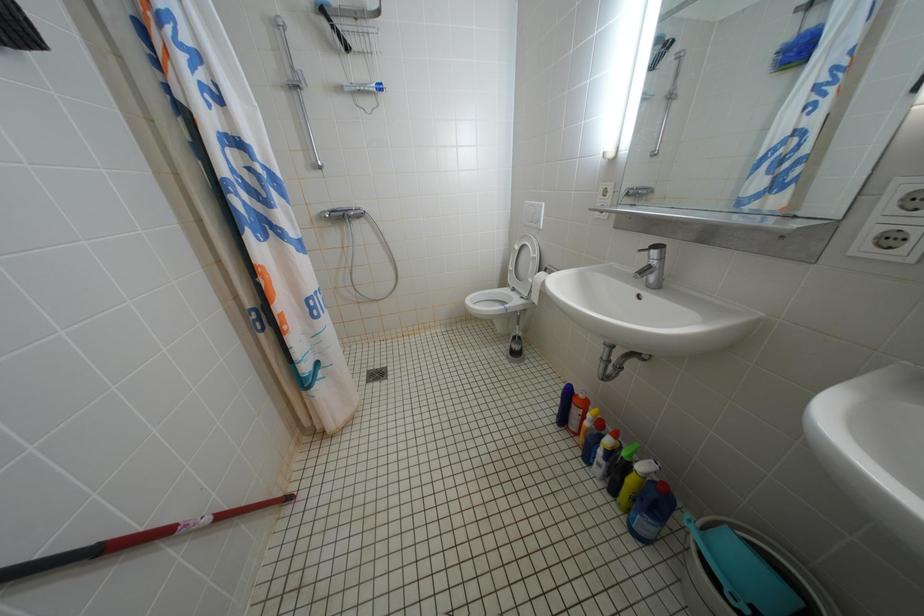
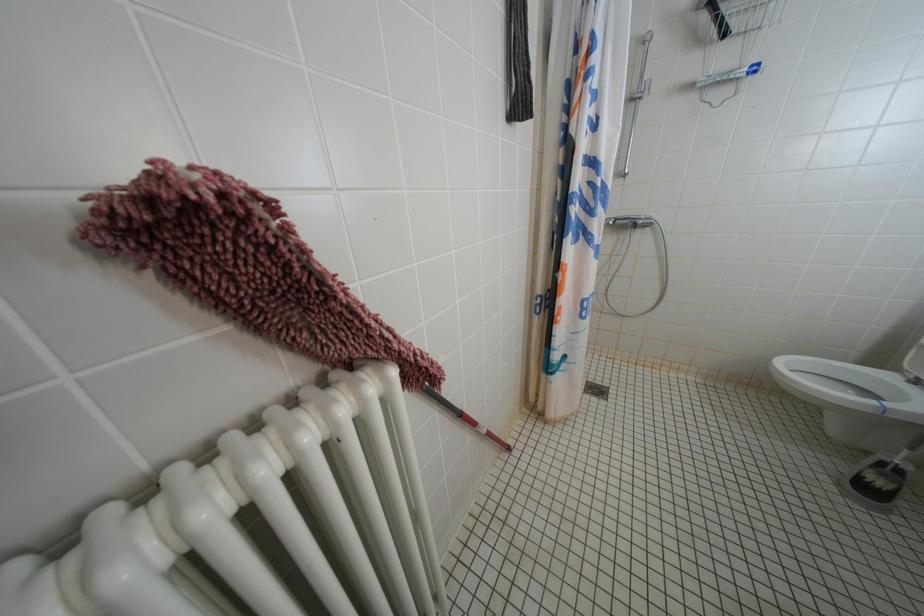
Question: Based on the continuous images, in which direction is the camera rotating? Reply with the corresponding letter.

Choices:
 (A) Left
 (B) Right
 (C) Up
 (D) Down

Answer: (A)